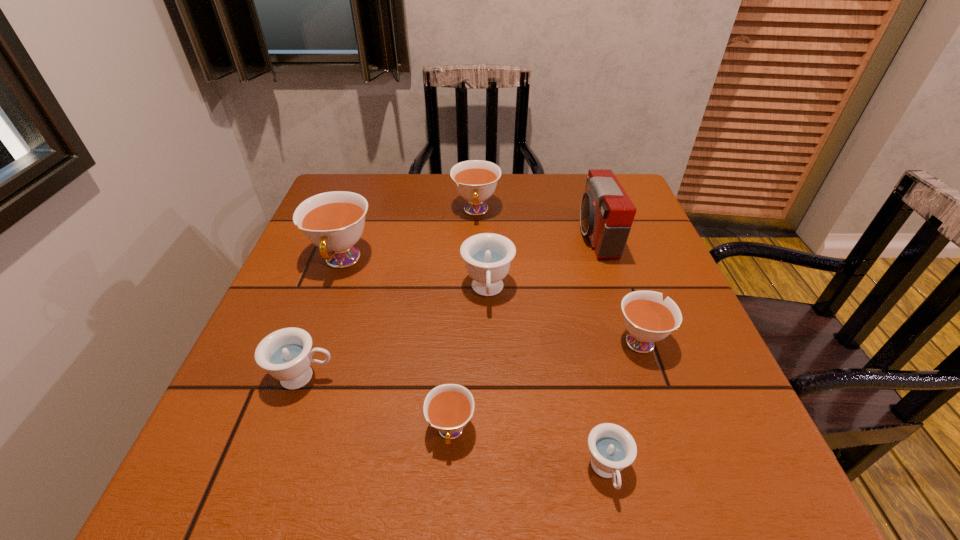
At what (x,y) coordinates should I click in order to perform the action: click on camera. Please return your answer as a coordinate pair (x, y). Image resolution: width=960 pixels, height=540 pixels. Looking at the image, I should click on (606, 213).

Where is `the second farthest white teacup`? This screenshot has height=540, width=960. the second farthest white teacup is located at coordinates (334, 221).

Locate an element on the screen. the tallest teacup is located at coordinates pyautogui.click(x=334, y=221).

Identify the location of the farthest teacup. This screenshot has height=540, width=960. (475, 180).

You are a GUI agent. You are given a task and a screenshot of the screen. Output one action in this format:
    pyautogui.click(x=<x>, y=<y>)
    Task: Click on the farthest white teacup
    This screenshot has height=540, width=960.
    Given the screenshot: What is the action you would take?
    [475, 180]

Locate an element on the screen. Image resolution: width=960 pixels, height=540 pixels. the farthest blue teacup is located at coordinates (487, 256).

Image resolution: width=960 pixels, height=540 pixels. I want to click on the biggest blue teacup, so click(x=487, y=256).

Image resolution: width=960 pixels, height=540 pixels. I want to click on the third biggest white teacup, so click(x=648, y=319).

Where is `the second nearest white teacup`? This screenshot has height=540, width=960. the second nearest white teacup is located at coordinates (648, 319).

Identify the location of the second smallest blue teacup. This screenshot has height=540, width=960. (286, 354).